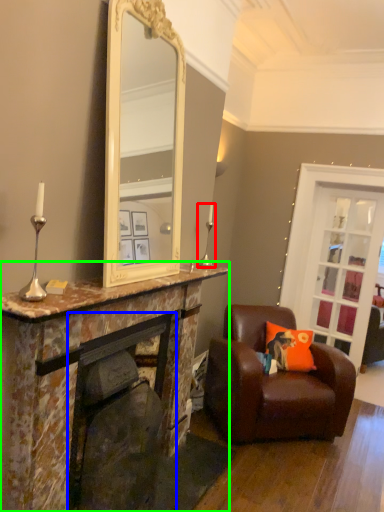
Question: Considering the real-world distances, which object is farthest from candle holder (highlighted by a red box)? fireplace (highlighted by a blue box) or cabinetry (highlighted by a green box)?

Choices:
 (A) fireplace
 (B) cabinetry

Answer: (A)